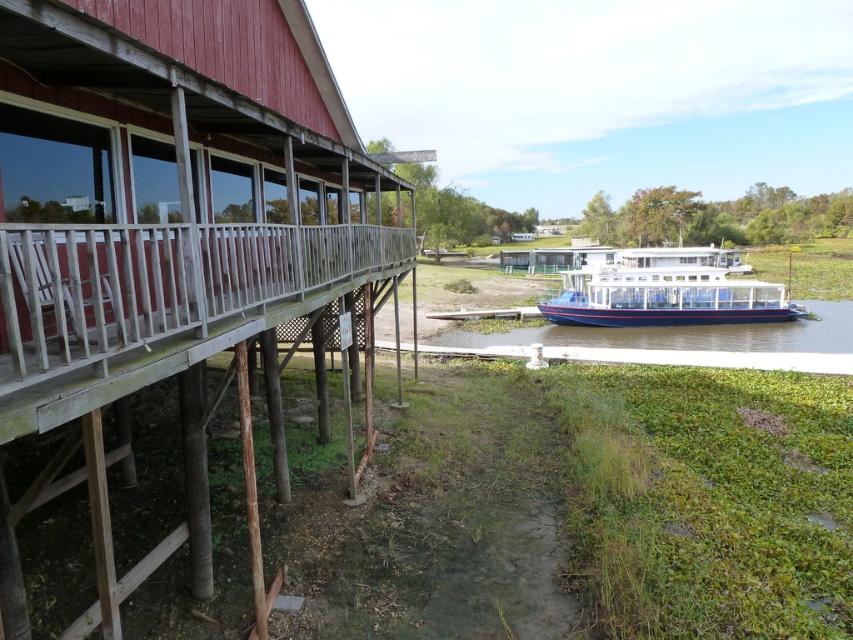
You are standing at the center of the image and want to walk to the wooden dock at left. In which direction should you move relative to your current position?

Since the wooden dock at left is located at point 0.353 on the x and 0.192 on the y coordinate, you should move to the left and slightly forward to reach it.

You are standing on the wooden dock at left and want to board the white glossy boat at center. Considering their heights, will you need to climb down or climb up to reach the boat?

The wooden dock at left is much taller than the white glossy boat at center, so you will need to climb down to reach the boat.

You are standing at the point marked by the coordinates point [163,225], which marks wooden dock at left. You want to walk towards the boat in the background. Which direction should you head?

Since the point [163,225] marks the wooden dock at left, and the boat is in the background, you should head towards the direction away from the wooden dock at left towards the river to reach the boat.